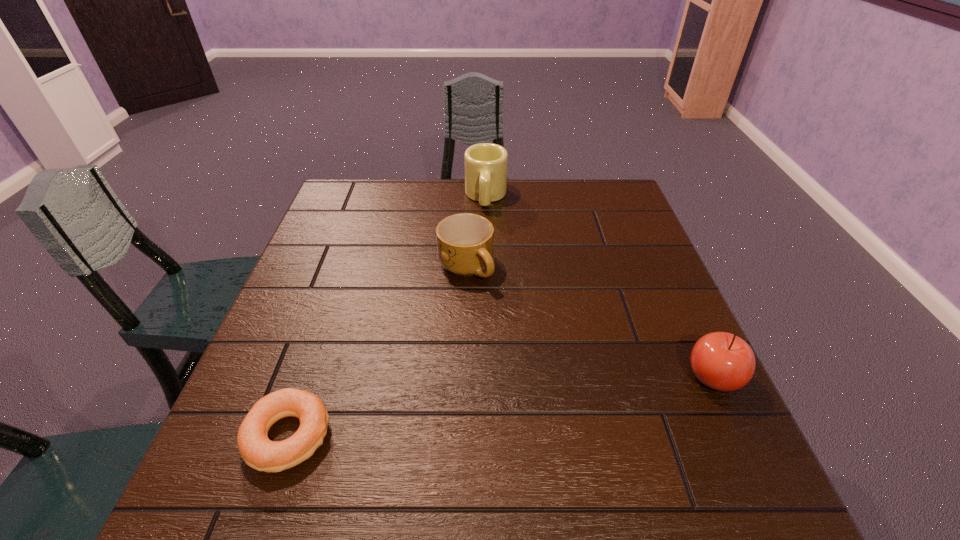
Where is `the leftmost object`? The height and width of the screenshot is (540, 960). the leftmost object is located at coordinates (258, 451).

Find the location of `bagel`. bagel is located at coordinates (258, 451).

Locate an element on the screen. Image resolution: width=960 pixels, height=540 pixels. the rightmost object is located at coordinates (722, 361).

Identify the location of the second farthest object. The width and height of the screenshot is (960, 540). (465, 242).

Identify the location of the shorter mug. The width and height of the screenshot is (960, 540). (465, 242).

You are a GUI agent. You are given a task and a screenshot of the screen. Output one action in this format:
    pyautogui.click(x=<x>, y=<y>)
    Task: Click on the farther mug
    This screenshot has width=960, height=540.
    Given the screenshot: What is the action you would take?
    pyautogui.click(x=486, y=164)

Find the location of a particular element. Image resolution: width=960 pixels, height=540 pixels. the farthest object is located at coordinates (486, 164).

Where is `vacant area situated on the right of the leftmost object`? The height and width of the screenshot is (540, 960). vacant area situated on the right of the leftmost object is located at coordinates (365, 436).

Find the location of a particular element. Image resolution: width=960 pixels, height=540 pixels. free location located on the left of the rightmost object is located at coordinates (500, 377).

At what (x,y) coordinates should I click in order to perform the action: click on free space located on the side with the handle of the second shortest object. Please return your answer as a coordinate pair (x, y). The height and width of the screenshot is (540, 960). Looking at the image, I should click on (483, 303).